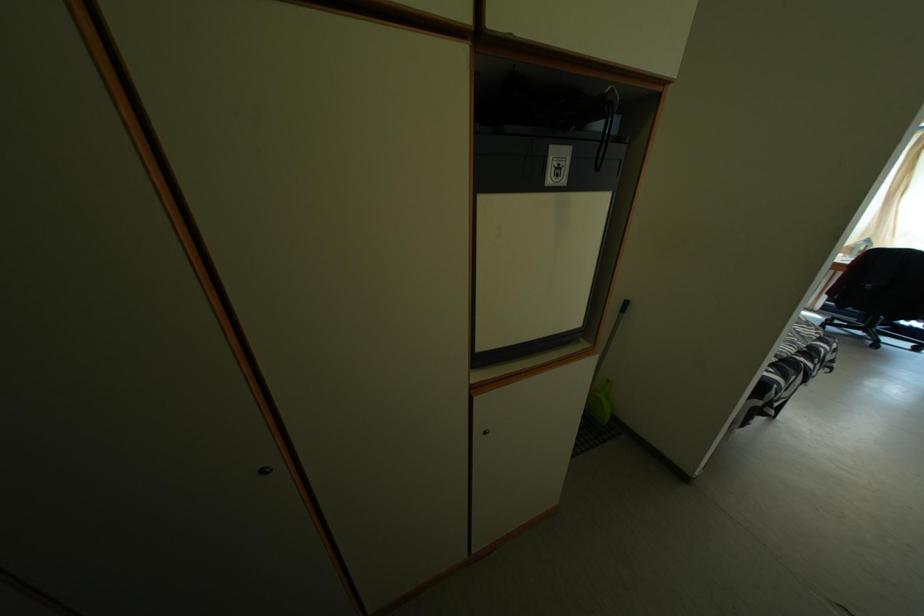
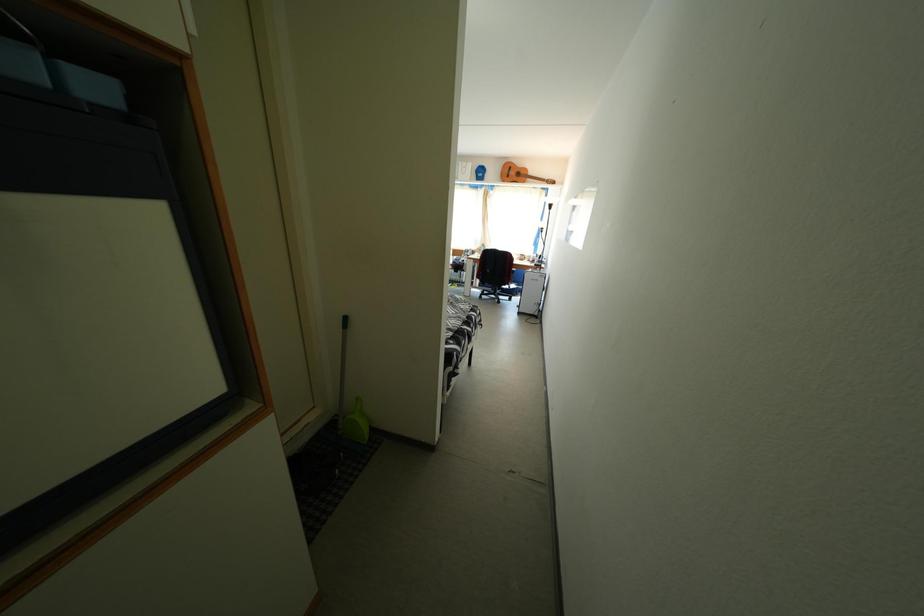
Question: The images are taken continuously from a first-person perspective. In which direction is your viewpoint rotating?

Choices:
 (A) Left
 (B) Right
 (C) Up
 (D) Down

Answer: (B)